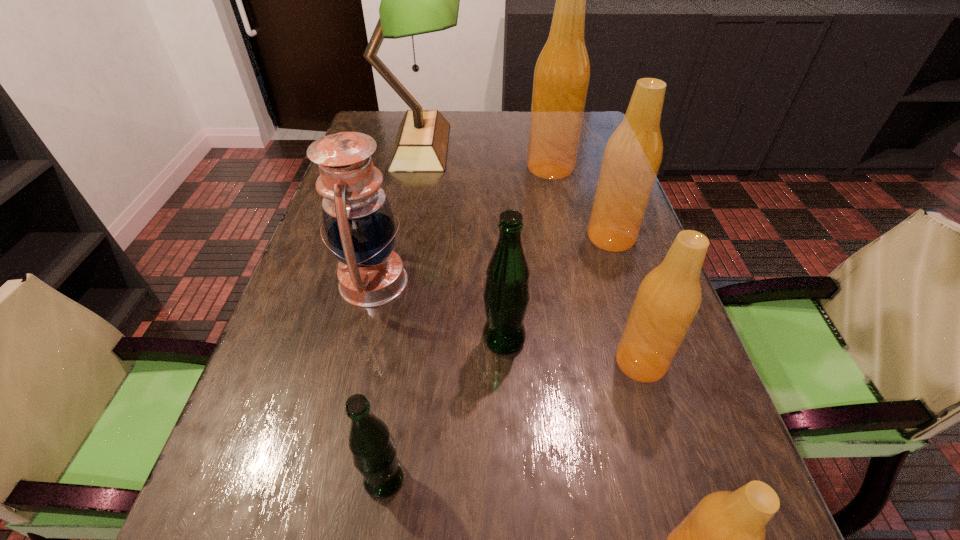
Find the location of a particular element. table lamp is located at coordinates (415, 0).

Identify the location of the farthest tan beer bottle. (561, 77).

Identify the location of the tallest beer bottle. (561, 77).

The image size is (960, 540). Identify the location of the second farthest beer bottle. (633, 154).

Find the location of a particular element. the fifth shortest beer bottle is located at coordinates (633, 154).

Locate an element on the screen. oil lamp is located at coordinates (358, 221).

Where is `the second smallest tan beer bottle`? The image size is (960, 540). the second smallest tan beer bottle is located at coordinates (669, 297).

At what (x,y) coordinates should I click in order to perform the action: click on the farther green beer bottle. Please return your answer as a coordinate pair (x, y). This screenshot has width=960, height=540. Looking at the image, I should click on (506, 295).

Find the location of a particular element. The width and height of the screenshot is (960, 540). the bigger green beer bottle is located at coordinates (506, 295).

Image resolution: width=960 pixels, height=540 pixels. What are the coordinates of `the left green beer bottle` in the screenshot? It's located at (373, 449).